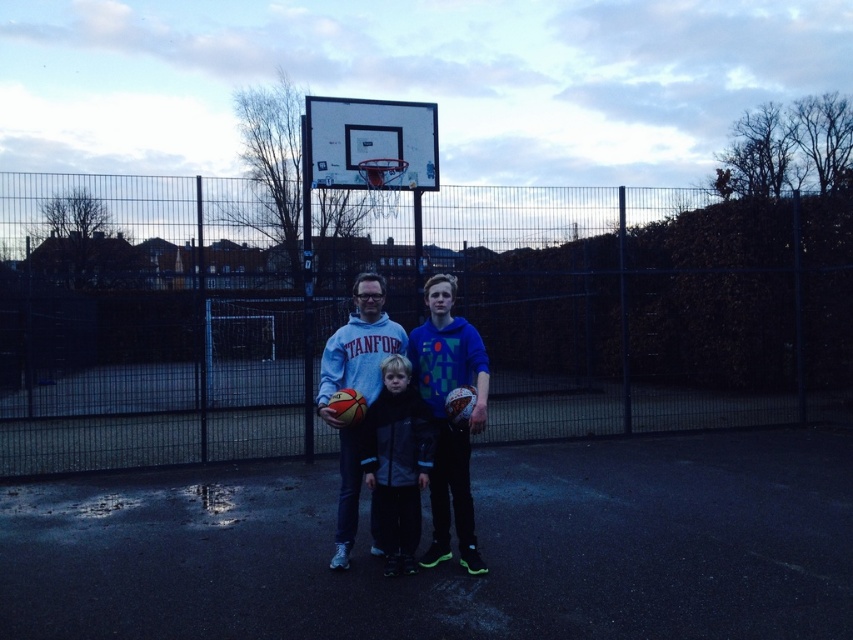
Does matte blue hoodie at center appear on the right side of dark gray fleece jacket at center?

Indeed, matte blue hoodie at center is positioned on the right side of dark gray fleece jacket at center.

Is matte blue hoodie at center wider than dark gray fleece jacket at center?

Correct, the width of matte blue hoodie at center exceeds that of dark gray fleece jacket at center.

Which is behind, point (476, 557) or point (383, 410)?

Point (476, 557)

The width and height of the screenshot is (853, 640). I want to click on matte blue hoodie at center, so click(450, 344).

Consider the image. Is dark gray fleece jacket at center below matte gray hoodie at center?

Indeed, dark gray fleece jacket at center is positioned under matte gray hoodie at center.

The height and width of the screenshot is (640, 853). Describe the element at coordinates (397, 461) in the screenshot. I see `dark gray fleece jacket at center` at that location.

At what (x,y) coordinates should I click in order to perform the action: click on dark gray fleece jacket at center. Please return your answer as a coordinate pair (x, y). The height and width of the screenshot is (640, 853). Looking at the image, I should click on (397, 461).

How much distance is there between matte blue hoodie at center and matte gray hoodie at center?

11.46 inches

Does point (340, 552) come farther from viewer compared to point (340, 512)?

No, it is not.

Which is in front, point (444, 308) or point (345, 465)?

Point (444, 308) is in front.

Image resolution: width=853 pixels, height=640 pixels. I want to click on matte blue hoodie at center, so click(450, 344).